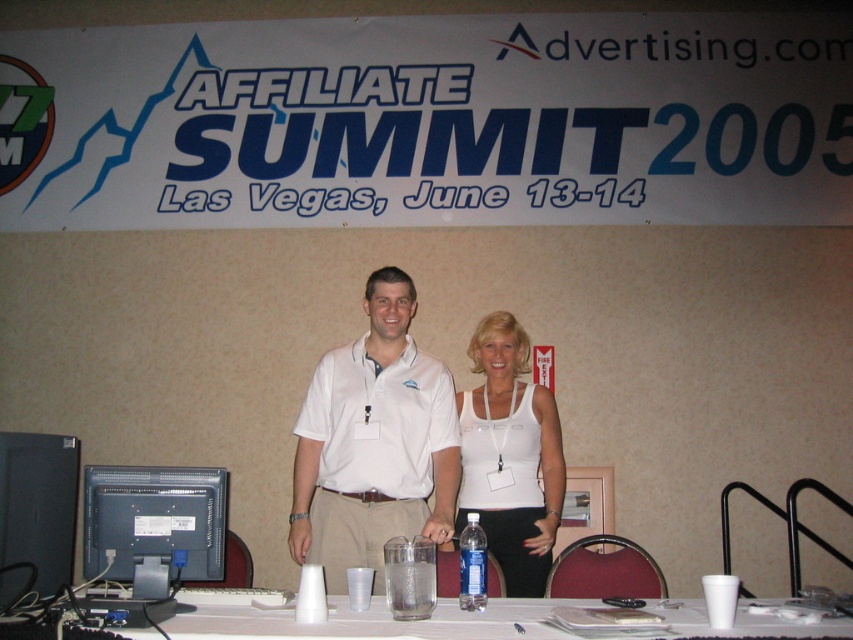
Is white cotton polo shirt at center positioned in front of matte gray monitor at lower left?

No, it is not.

Based on the photo, does white cotton polo shirt at center appear over matte gray monitor at lower left?

Correct, white cotton polo shirt at center is located above matte gray monitor at lower left.

Between point (419, 518) and point (113, 531), which one is positioned in front?

Point (113, 531) is more forward.

Locate an element on the screen. The image size is (853, 640). white cotton polo shirt at center is located at coordinates (373, 442).

Does point (550, 563) come farther from viewer compared to point (567, 520)?

No, it is in front of (567, 520).

Who is shorter, white matte tank top at center or metallic silver bulletin board at center?

metallic silver bulletin board at center is shorter.

What are the coordinates of `white matte tank top at center` in the screenshot? It's located at (509, 456).

Find the location of a particular element. Image resolution: width=853 pixels, height=640 pixels. white matte tank top at center is located at coordinates coord(509,456).

Is white cotton polo shirt at center smaller than metallic silver bulletin board at center?

No, white cotton polo shirt at center is not smaller than metallic silver bulletin board at center.

Is white cotton polo shirt at center to the left of metallic silver bulletin board at center from the viewer's perspective?

Indeed, white cotton polo shirt at center is positioned on the left side of metallic silver bulletin board at center.

Does point (305, 429) come behind point (566, 540)?

No, (305, 429) is closer to viewer.

You are a GUI agent. You are given a task and a screenshot of the screen. Output one action in this format:
    pyautogui.click(x=<x>, y=<y>)
    Task: Click on the white cotton polo shirt at center
    The image size is (853, 640).
    Given the screenshot: What is the action you would take?
    pyautogui.click(x=373, y=442)